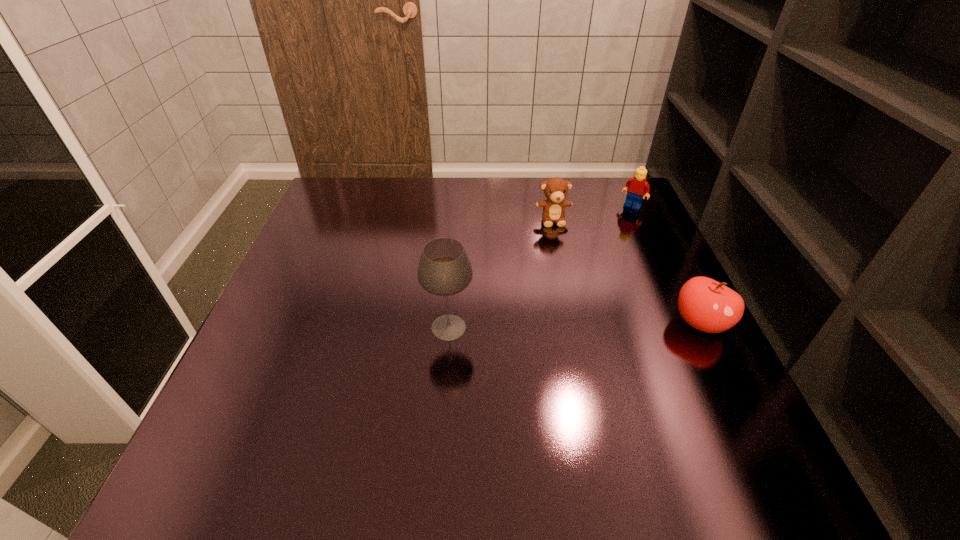
In order to click on vacant area located 0.390m on the face of the teddy bear in this screenshot , I will do `click(586, 342)`.

Identify the location of free space located 0.390m on the front-facing side of the farthest object. The image size is (960, 540). pyautogui.click(x=567, y=291).

Identify the location of vacant position located on the front-facing side of the farthest object. Image resolution: width=960 pixels, height=540 pixels. (588, 262).

Locate an element on the screen. This screenshot has height=540, width=960. free space located 0.360m on the front-facing side of the farthest object is located at coordinates (573, 283).

Locate an element on the screen. teddy bear that is at the far edge is located at coordinates (555, 189).

Find the location of `Lego located at the far edge`. Lego located at the far edge is located at coordinates (636, 187).

Where is `apple located at the right edge`? apple located at the right edge is located at coordinates (706, 304).

The width and height of the screenshot is (960, 540). What are the coordinates of `Lego that is at the right edge` in the screenshot? It's located at 636,187.

At what (x,y) coordinates should I click in order to perform the action: click on object that is at the far right corner. Please return your answer as a coordinate pair (x, y). Image resolution: width=960 pixels, height=540 pixels. Looking at the image, I should click on (636, 187).

Locate an element on the screen. The width and height of the screenshot is (960, 540). free space at the far edge of the desktop is located at coordinates (414, 191).